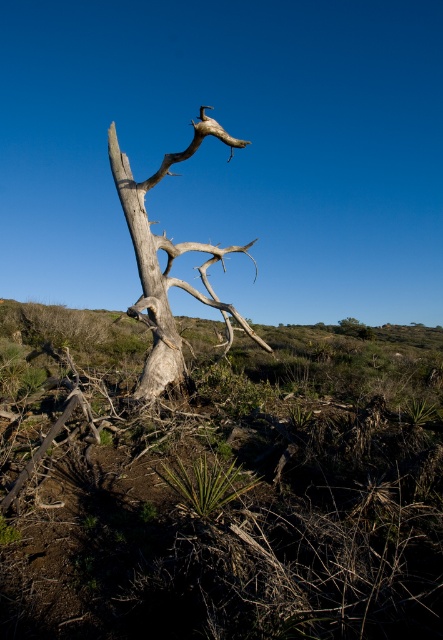
You are an arborist examining the gray textured tree trunk at center and the gray rough bark tree trunk at center in the image. Which of these two trunks is taller?

The gray textured tree trunk at center is taller than the gray rough bark tree trunk at center according to the description.

You are an arborist examining the tree from the ground. You notice the gray textured tree trunk at center and the gray rough bark tree trunk at center. Which part of the tree is higher up?

The gray textured tree trunk at center is located above the gray rough bark tree trunk at center, so the gray textured tree trunk at center is higher up.